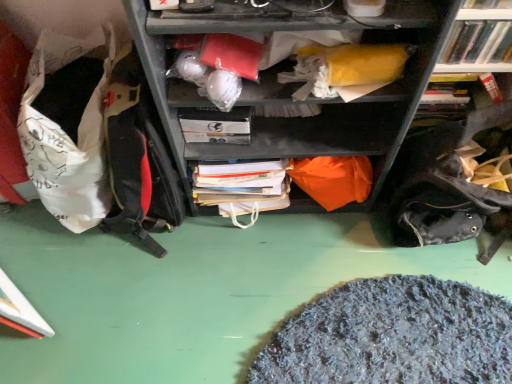
Where is `white matte paperback book at center`? The height and width of the screenshot is (384, 512). white matte paperback book at center is located at coordinates (215, 125).

Describe the element at coordinates (69, 125) in the screenshot. This screenshot has height=384, width=512. I see `white fabric bean bag at left` at that location.

Measure the distance between white plastic books at upper right and camera.

white plastic books at upper right and camera are 91.25 centimeters apart.

Locate an element on the screen. The image size is (512, 384). white matte paperback book at center is located at coordinates (215, 125).

Does white plastic books at upper right have a larger size compared to white matte paperback book at center?

Indeed, white plastic books at upper right has a larger size compared to white matte paperback book at center.

Where is `paperback book behind the white plastic books at upper right`? The height and width of the screenshot is (384, 512). paperback book behind the white plastic books at upper right is located at coordinates (215, 125).

Is white plastic books at upper right to the right of white matte paperback book at center from the viewer's perspective?

Correct, you'll find white plastic books at upper right to the right of white matte paperback book at center.

Would you say white fabric bean bag at left is inside or outside white matte paperback book at center?

white fabric bean bag at left is not enclosed by white matte paperback book at center.

How distant is white fabric bean bag at left from white matte paperback book at center?

The distance of white fabric bean bag at left from white matte paperback book at center is 13.18 inches.

From a real-world perspective, does white fabric bean bag at left sit lower than white matte paperback book at center?

Yes, from a real-world perspective, white fabric bean bag at left is below white matte paperback book at center.

From a real-world perspective, is white fabric bean bag at left physically below white plastic books at upper right?

Correct, in the physical world, white fabric bean bag at left is lower than white plastic books at upper right.

Looking at their sizes, would you say white fabric bean bag at left is wider or thinner than white plastic books at upper right?

white fabric bean bag at left is wider than white plastic books at upper right.

Can you see white fabric bean bag at left touching white plastic books at upper right?

No, white fabric bean bag at left is not making contact with white plastic books at upper right.

Is white fabric bean bag at left oriented away from white plastic books at upper right?

That's not correct — white fabric bean bag at left is not looking away from white plastic books at upper right.

How many degrees apart are the facing directions of white matte paperback book at center and white fabric bean bag at left?

The angular difference between white matte paperback book at center and white fabric bean bag at left is 0.000432 degrees.

Find the location of a particular element. bean bag chair lying below the white matte paperback book at center (from the image's perspective) is located at coordinates (69, 125).

Does white matte paperback book at center have a greater height compared to white fabric bean bag at left?

Incorrect, the height of white matte paperback book at center is not larger of that of white fabric bean bag at left.

From the picture: From the image's perspective, which one is positioned lower, white plastic books at upper right or white fabric bean bag at left?

white fabric bean bag at left.

Is white plastic books at upper right next to white fabric bean bag at left and touching it?

There is a gap between white plastic books at upper right and white fabric bean bag at left.

Which object is further away from the camera taking this photo, white plastic books at upper right or white fabric bean bag at left?

white plastic books at upper right.

How many degrees apart are the facing directions of white plastic books at upper right and white fabric bean bag at left?

The facing directions of white plastic books at upper right and white fabric bean bag at left are 0.000493 degrees apart.

From the image's perspective, relative to white plastic books at upper right, is white matte paperback book at center above or below?

white matte paperback book at center is below white plastic books at upper right.

Considering the positions of objects white matte paperback book at center and white plastic books at upper right in the image provided, who is behind, white matte paperback book at center or white plastic books at upper right?

white matte paperback book at center is further from the camera.

You are a GUI agent. You are given a task and a screenshot of the screen. Output one action in this format:
    pyautogui.click(x=<x>, y=<y>)
    Task: Click on the bookcase that appears above the white matte paperback book at center (from a real-world perspective)
    
    Given the screenshot: What is the action you would take?
    pyautogui.click(x=477, y=42)

From a real-world perspective, is white matte paperback book at center located beneath white plastic books at upper right?

Yes, from a real-world perspective, white matte paperback book at center is under white plastic books at upper right.

Find the location of a particular element. This screenshot has width=512, height=384. bookcase above the white matte paperback book at center (from a real-world perspective) is located at coordinates click(477, 42).

Find the location of a particular element. This screenshot has height=384, width=512. bean bag chair in front of the white matte paperback book at center is located at coordinates [69, 125].

Looking at the image, which one is located further to white matte paperback book at center, white fabric bean bag at left or white plastic books at upper right?

Among the two, white plastic books at upper right is located further to white matte paperback book at center.

Considering their positions, is white matte paperback book at center positioned further to white fabric bean bag at left than white plastic books at upper right?

Among the two, white plastic books at upper right is located further to white fabric bean bag at left.

Looking at the image, which one is located further to white matte paperback book at center, white plastic books at upper right or white fabric bean bag at left?

white plastic books at upper right.

Which object lies nearer to the anchor point white fabric bean bag at left, white plastic books at upper right or white matte paperback book at center?

white matte paperback book at center lies closer to white fabric bean bag at left than the other object.

Considering their positions, is white fabric bean bag at left positioned further to white plastic books at upper right than white matte paperback book at center?

white fabric bean bag at left is further to white plastic books at upper right.

Based on their spatial positions, is white matte paperback book at center or white fabric bean bag at left closer to white plastic books at upper right?

The object closer to white plastic books at upper right is white matte paperback book at center.

This screenshot has height=384, width=512. Identify the location of paperback book between white fabric bean bag at left and white plastic books at upper right. (215, 125).